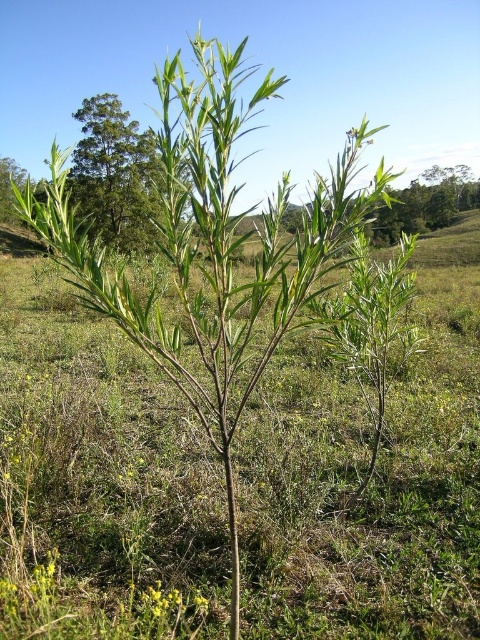
Question: Can you confirm if green leafy tree at upper left is bigger than yellow matte flower at lower center?

Choices:
 (A) yes
 (B) no

Answer: (A)

Question: Which object appears closest to the camera in this image?

Choices:
 (A) yellow matte flower at lower center
 (B) green leafy tree at upper left

Answer: (A)

Question: Is green leafy tree at upper left smaller than yellow matte flower at lower center?

Choices:
 (A) no
 (B) yes

Answer: (A)

Question: Does green leafy tree at upper left have a larger size compared to yellow matte flower at lower center?

Choices:
 (A) yes
 (B) no

Answer: (A)